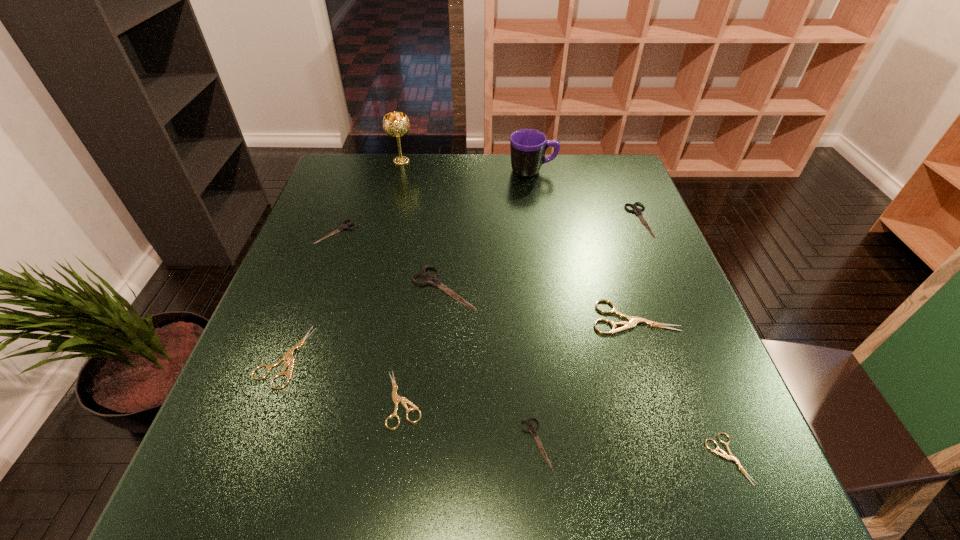
Find the location of `unoccupied area between the black mug and the smallest black shears`. unoccupied area between the black mug and the smallest black shears is located at coordinates (534, 306).

At what (x,y) coordinates should I click in order to perform the action: click on vacant space that is in between the second biggest black shears and the second smallest black shears. Please return your answer as a coordinate pair (x, y). Looking at the image, I should click on (489, 226).

Image resolution: width=960 pixels, height=540 pixels. I want to click on free space that is in between the rightmost black shears and the second smallest beige shears, so click(x=521, y=310).

Locate which object ranks in proximity to the tallest object. Please provide its 2D coordinates. Your answer should be formatted as a tuple, i.e. [(x, y)], where the tuple contains the x and y coordinates of a point satisfying the conditions above.

[(343, 226)]

Find the location of a particular element. the second closest object to the leftmost beige shears is located at coordinates (429, 279).

This screenshot has height=540, width=960. In order to click on the sixth closest shears to the second biggest beige shears in this screenshot , I will do 724,455.

Where is `the seventh closest shears to the second smallest beige shears`? This screenshot has height=540, width=960. the seventh closest shears to the second smallest beige shears is located at coordinates (636, 210).

Choose which black shears is the nearest neighbor to the nearest black shears. Please provide its 2D coordinates. Your answer should be formatted as a tuple, i.e. [(x, y)], where the tuple contains the x and y coordinates of a point satisfying the conditions above.

[(429, 279)]

The width and height of the screenshot is (960, 540). I want to click on black shears that can be found as the fourth closest to the biggest beige shears, so click(343, 226).

At what (x,y) coordinates should I click in order to perform the action: click on beige shears that can be found as the fourth closest to the nearest black shears. Please return your answer as a coordinate pair (x, y). Looking at the image, I should click on (288, 356).